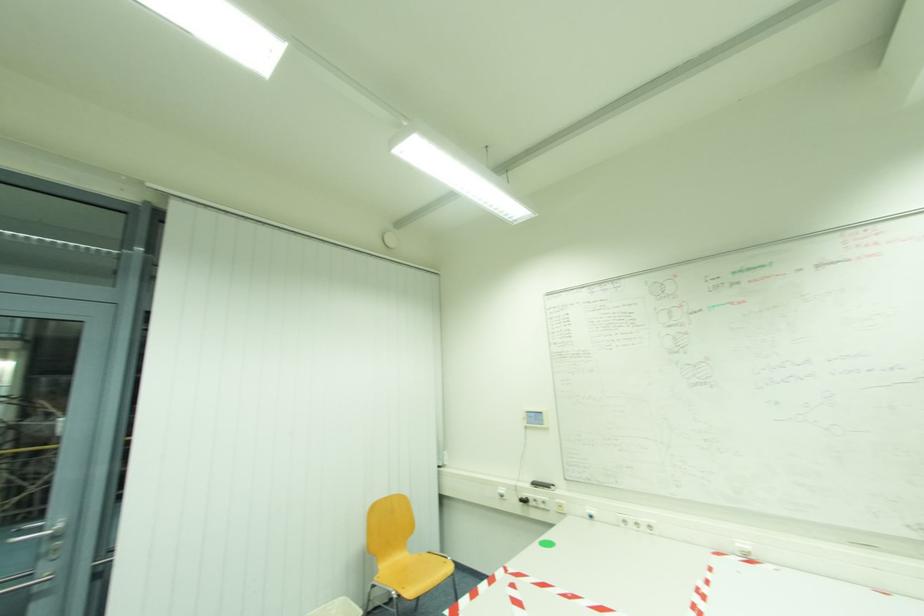
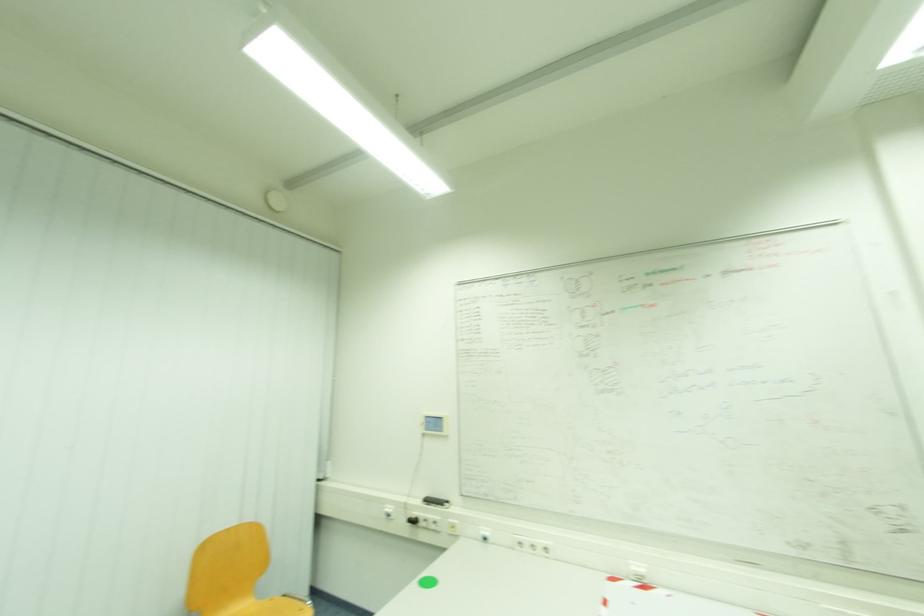
What movement of the cameraman would produce the second image?

The movement direction of the cameraman is right, forward.